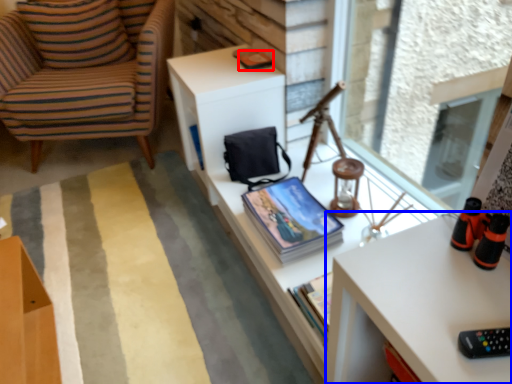
Question: Among these objects, which one is farthest to the camera, magazine (highlighted by a red box) or desk (highlighted by a blue box)?

Choices:
 (A) magazine
 (B) desk

Answer: (A)